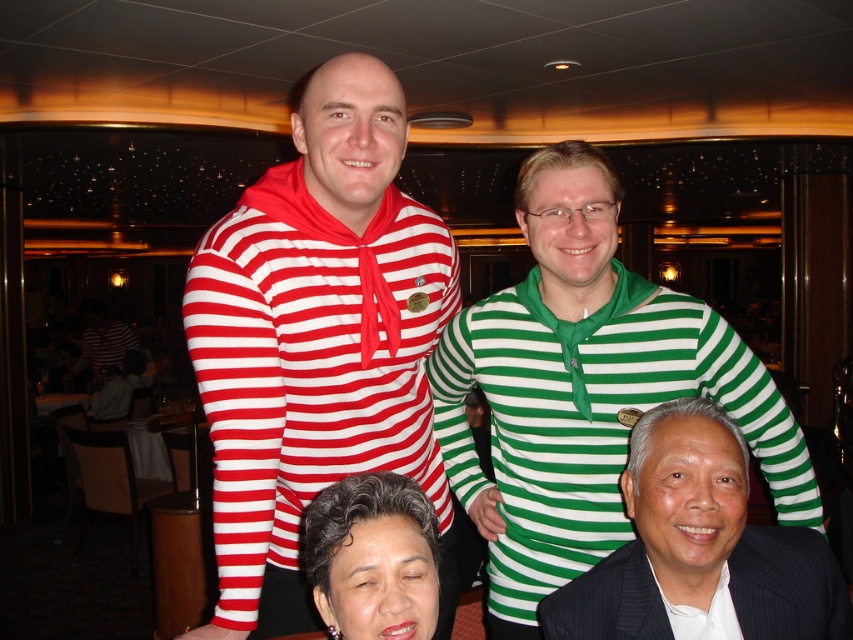
Question: Among these points, which one is farthest from the camera?

Choices:
 (A) (776, 492)
 (B) (364, 358)
 (C) (403, 528)

Answer: (A)

Question: Is green striped shirt at center further to camera compared to smooth black hair at lower center?

Choices:
 (A) no
 (B) yes

Answer: (B)

Question: Considering the relative positions of green striped shirt at upper right and smooth black hair at lower center in the image provided, where is green striped shirt at upper right located with respect to smooth black hair at lower center?

Choices:
 (A) above
 (B) below

Answer: (A)

Question: Which of the following is the closest to the observer?

Choices:
 (A) smooth black hair at lower center
 (B) green striped shirt at upper right
 (C) green striped shirt at center

Answer: (A)

Question: Does green striped shirt at center appear on the left side of smooth black hair at lower center?

Choices:
 (A) yes
 (B) no

Answer: (B)

Question: Which of the following is the closest to the observer?

Choices:
 (A) (202, 332)
 (B) (666, 396)
 (C) (793, 632)
 (D) (334, 595)

Answer: (D)